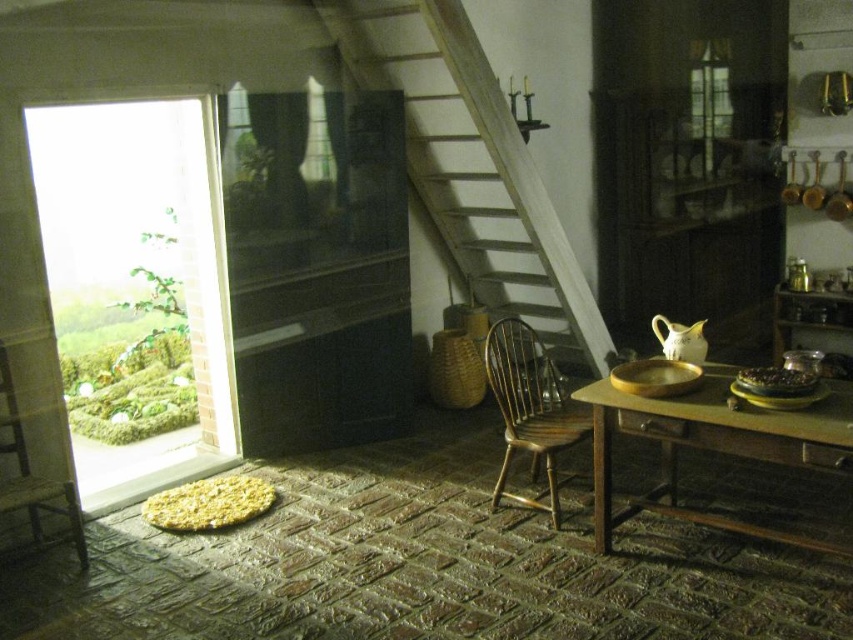
You are standing in the room and want to exit through the doorway on the left. Which direction should you move relative to the wooden stairs at center?

You should move to the left relative to the wooden stairs at center to exit through the doorway on the left.

You are moving a 6.5 feet long ladder from the wooden table at lower right to the wooden stairs at center. Can you move the ladder without tilting it sideways?

The distance between the wooden stairs at center and wooden table at lower right is 6.40 feet, which is shorter than the ladder length of 6.5 feet. Therefore, the ladder cannot be moved horizontally between them without tilting.